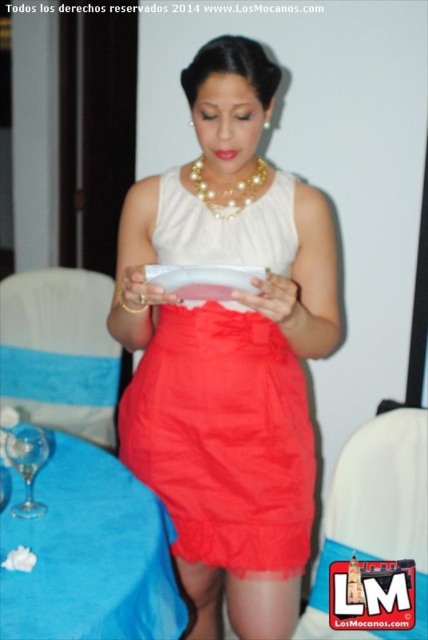
Does blue fabric table at lower left have a lesser width compared to pearl/textured necklace at center?

In fact, blue fabric table at lower left might be wider than pearl/textured necklace at center.

Can you confirm if blue fabric table at lower left is smaller than pearl/textured necklace at center?

Incorrect, blue fabric table at lower left is not smaller in size than pearl/textured necklace at center.

Where is `blue fabric table at lower left`? The width and height of the screenshot is (428, 640). blue fabric table at lower left is located at coordinates (89, 554).

How much distance is there between white satin dress at center and blue fabric table at lower left?

white satin dress at center is 11.89 inches from blue fabric table at lower left.

Is point (237, 392) behind point (95, 627)?

Yes.

Which is in front, point (151, 179) or point (86, 481)?

Point (86, 481)

Image resolution: width=428 pixels, height=640 pixels. Find the location of `white satin dress at center`. white satin dress at center is located at coordinates (228, 390).

Identify the location of white satin dress at center. (228, 390).

Find the location of a particular element. The image size is (428, 640). white satin dress at center is located at coordinates (228, 390).

Locate an element on the screen. white satin dress at center is located at coordinates (228, 390).